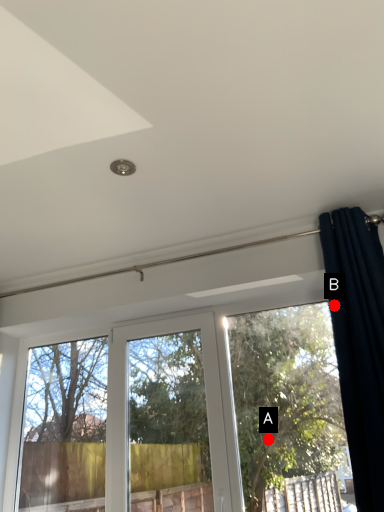
Question: Two points are circled on the image, labeled by A and B beside each circle. Which point appears closest to the camera in this image?

Choices:
 (A) A is closer
 (B) B is closer

Answer: (B)